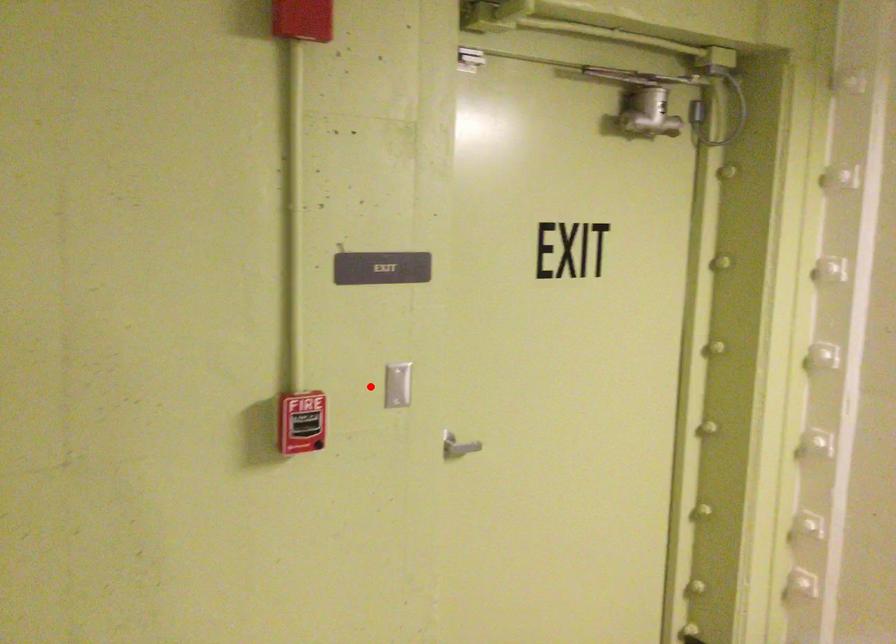
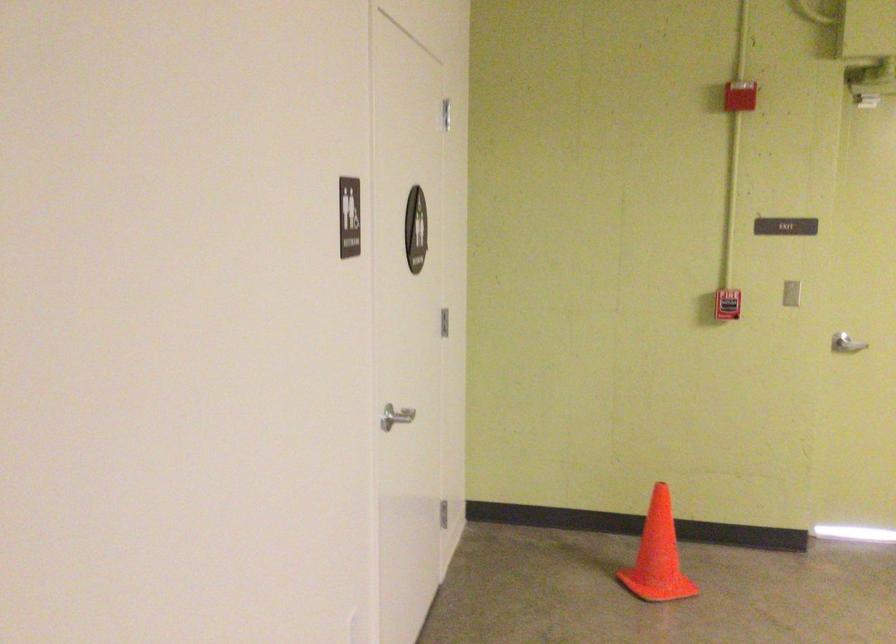
Question: I am providing you with two images of the same scene from different viewpoints. In image1, a red point is highlighted. Considering the same 3D point in image2, which of the following is correct?

Choices:
 (A) It is closer
 (B) It is farther

Answer: (B)